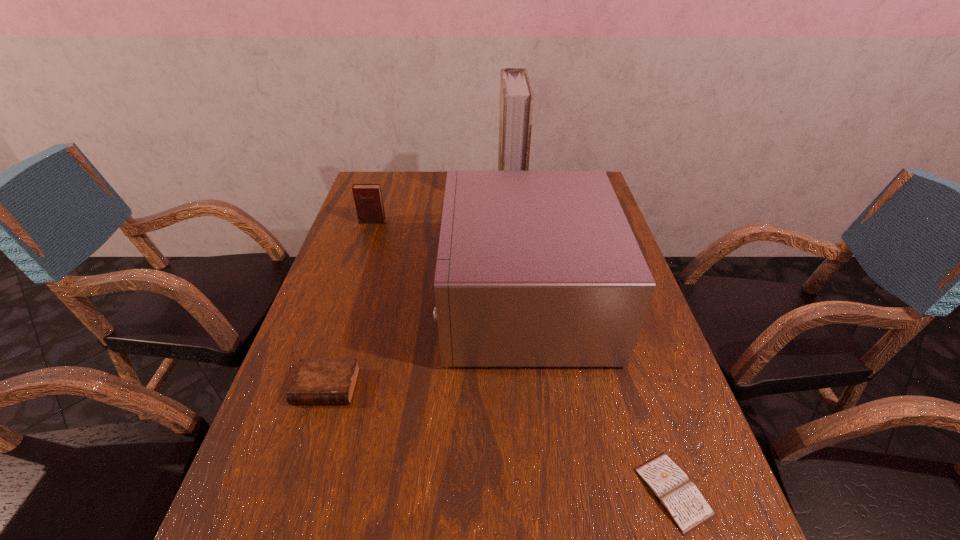
In order to click on phonebook in this screenshot , I will do `click(516, 96)`.

In order to click on the tallest object in this screenshot , I will do `click(516, 96)`.

Identify the location of the second tallest object. (536, 268).

Identify the location of the farthest diary. (368, 200).

At what (x,y) coordinates should I click in order to perform the action: click on the second farthest object. Please return your answer as a coordinate pair (x, y). This screenshot has height=540, width=960. Looking at the image, I should click on (368, 200).

Find the location of a particular element. the second nearest diary is located at coordinates (316, 381).

Find the location of `the second shortest object`. the second shortest object is located at coordinates (316, 381).

At what (x,y) coordinates should I click in order to perform the action: click on the nearest diary. Please return your answer as a coordinate pair (x, y). This screenshot has width=960, height=540. Looking at the image, I should click on (681, 499).

Where is `the shortest diary`? Image resolution: width=960 pixels, height=540 pixels. the shortest diary is located at coordinates (681, 499).

Identify the location of vacant area situated on the cover of the tallest object. (470, 194).